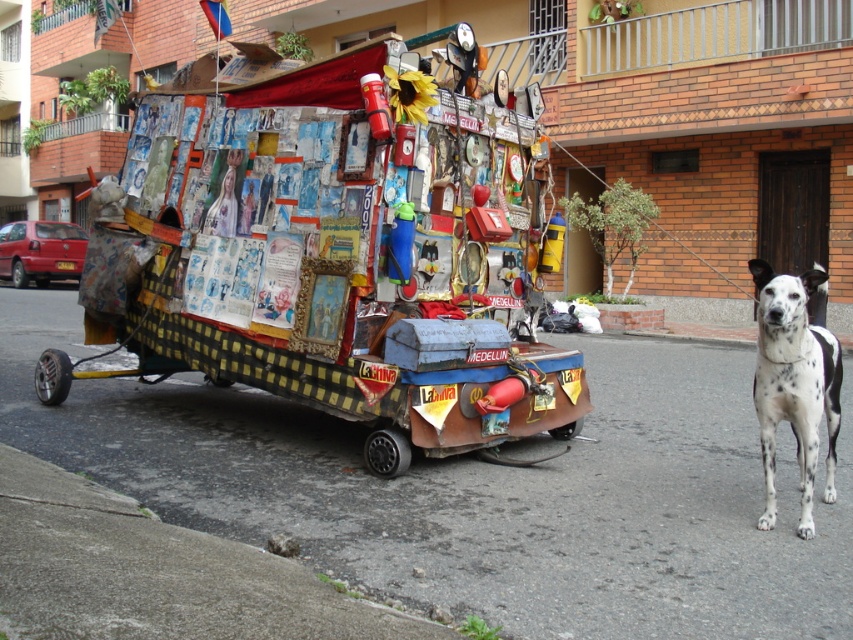
Question: Can you confirm if decorative cardboard cart at center is positioned to the left of white-spotted fur dog at right?

Choices:
 (A) yes
 (B) no

Answer: (A)

Question: Can you confirm if decorative cardboard cart at center is positioned below white-spotted fur dog at right?

Choices:
 (A) yes
 (B) no

Answer: (B)

Question: Is decorative cardboard cart at center wider than white-spotted fur dog at right?

Choices:
 (A) no
 (B) yes

Answer: (B)

Question: Which object is farther from the camera taking this photo?

Choices:
 (A) decorative cardboard cart at center
 (B) white-spotted fur dog at right

Answer: (A)

Question: Which of the following is the closest to the observer?

Choices:
 (A) white-spotted fur dog at right
 (B) decorative cardboard cart at center

Answer: (A)

Question: Among these points, which one is nearest to the camera?

Choices:
 (A) (177, 348)
 (B) (820, 353)

Answer: (B)